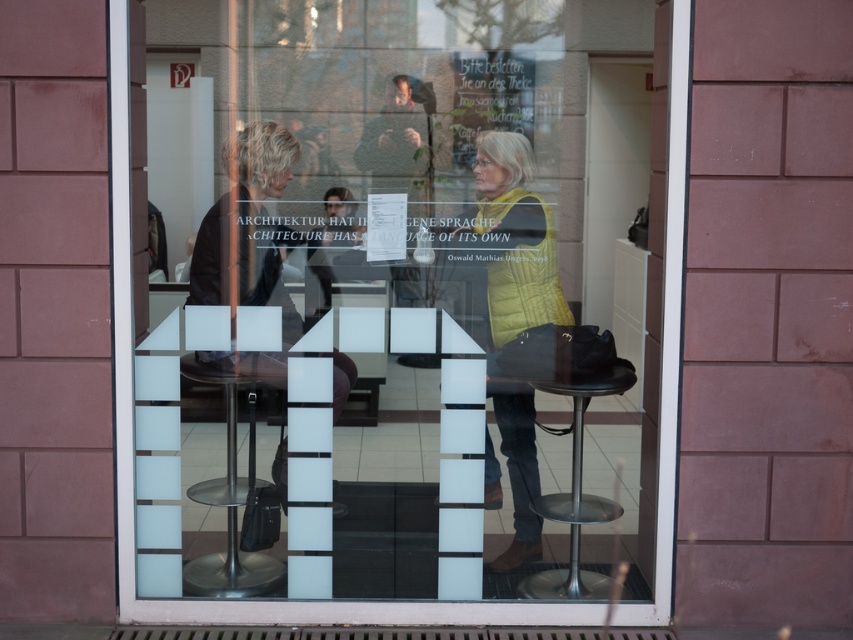
Is point (247, 289) behind point (186, 589)?

Yes, it is.

Can you confirm if matte black jacket at center is positioned to the right of metallic silver stool at center?

Correct, you'll find matte black jacket at center to the right of metallic silver stool at center.

Is point (254, 156) positioned in front of point (256, 570)?

Yes, point (254, 156) is in front of point (256, 570).

Where is `matte black jacket at center`? This screenshot has height=640, width=853. matte black jacket at center is located at coordinates tap(250, 248).

Find the location of `transparent glass window at center`. transparent glass window at center is located at coordinates (334, 310).

Which is behind, point (299, 550) or point (479, 202)?

Positioned behind is point (479, 202).

Locate an element on the screen. The image size is (853, 640). transparent glass window at center is located at coordinates (334, 310).

What are the coordinates of `transparent glass window at center` in the screenshot? It's located at (334, 310).

Does transparent glass window at center have a greater width compared to metallic black stool at lower right?

Yes.

Based on the photo, can you confirm if transparent glass window at center is shorter than metallic black stool at lower right?

No.

Image resolution: width=853 pixels, height=640 pixels. What do you see at coordinates (334, 310) in the screenshot? I see `transparent glass window at center` at bounding box center [334, 310].

Locate an element on the screen. This screenshot has width=853, height=640. transparent glass window at center is located at coordinates (334, 310).